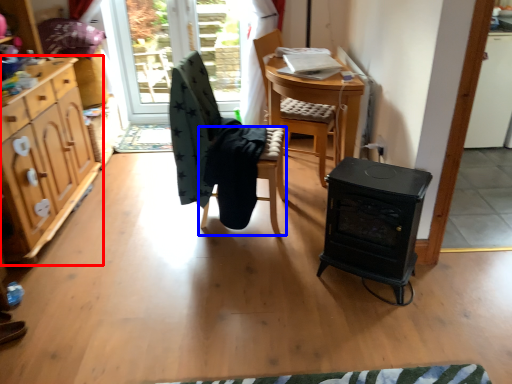
Question: Which of the following is the farthest to the observer, cabinetry (highlighted by a red box) or chair (highlighted by a blue box)?

Choices:
 (A) cabinetry
 (B) chair

Answer: (B)